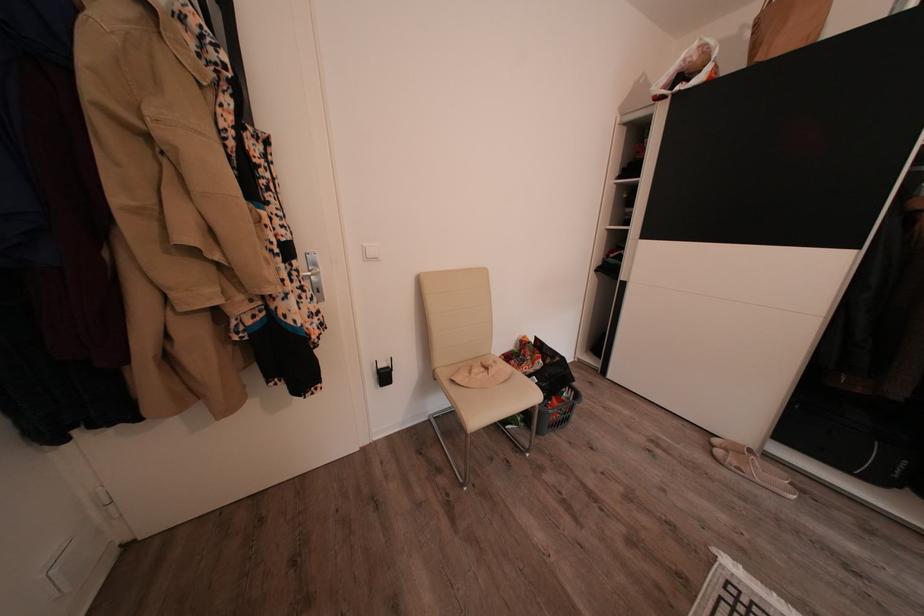
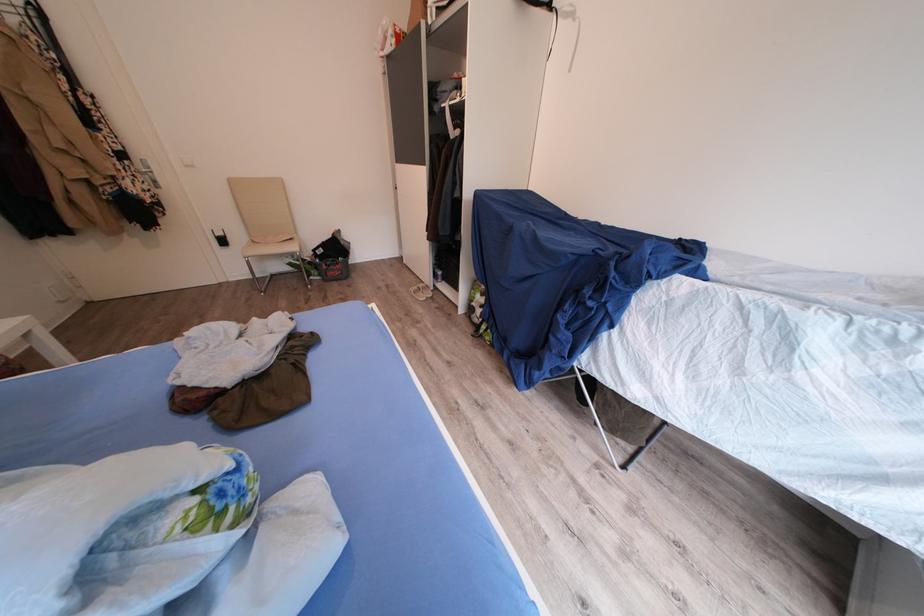
The images are taken continuously from a first-person perspective. In which direction are you moving?

The cameraman walked toward right, backward.